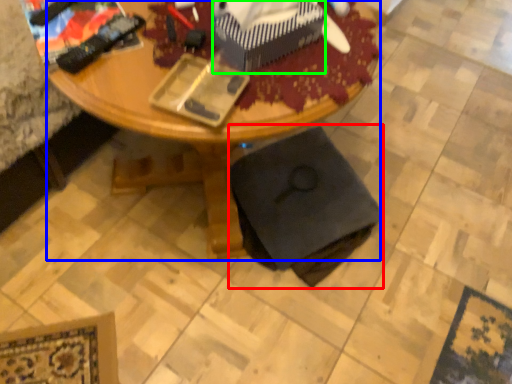
Question: Which object is the farthest from swivel chair (highlighted by a red box)? Choose among these: desk (highlighted by a blue box) or box (highlighted by a green box).

Choices:
 (A) desk
 (B) box

Answer: (B)